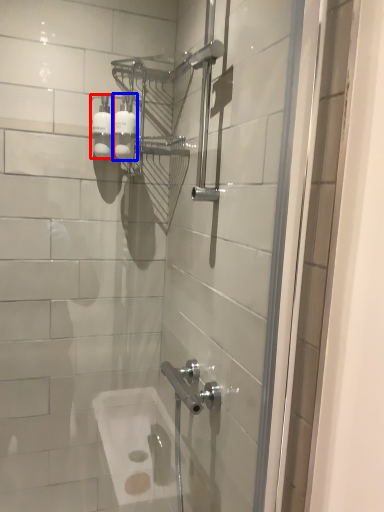
Question: Which point is further to the camera, toiletry (highlighted by a red box) or toiletry (highlighted by a blue box)?

Choices:
 (A) toiletry
 (B) toiletry

Answer: (A)